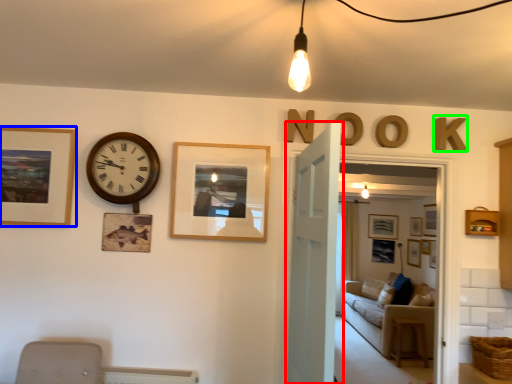
Question: Which object is positioned closest to door (highlighted by a red box)? Select from picture frame (highlighted by a blue box) and letter (highlighted by a green box).

Choices:
 (A) picture frame
 (B) letter

Answer: (B)